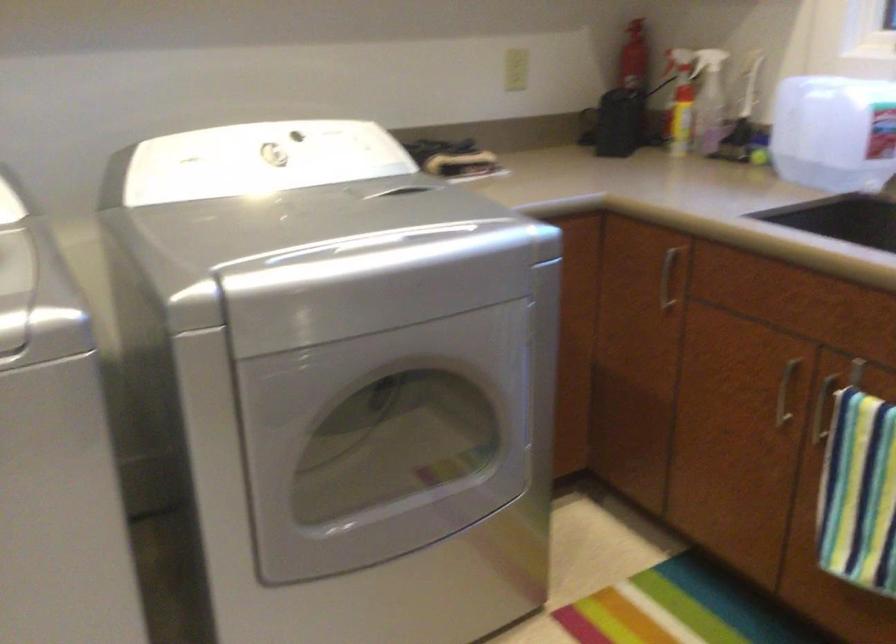
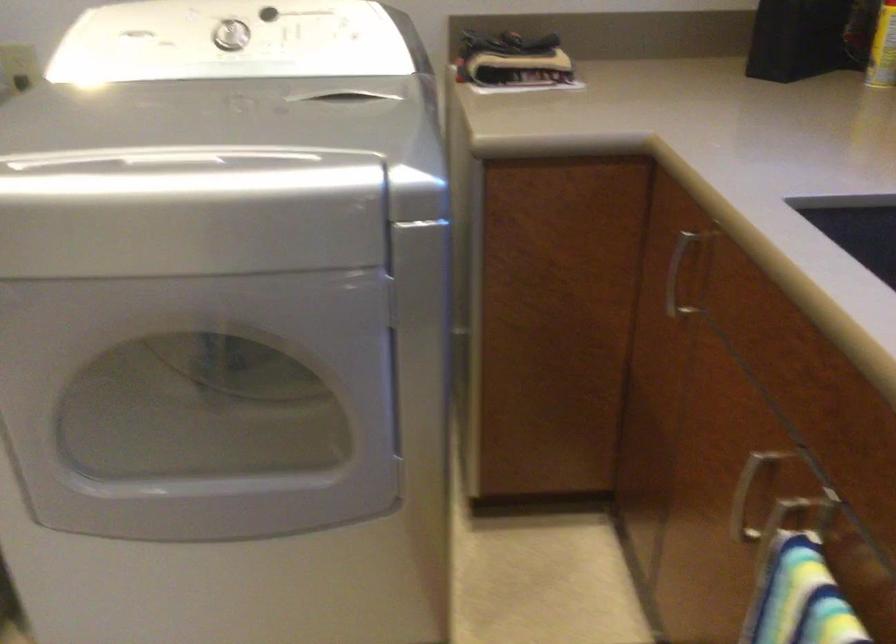
What movement of the cameraman would produce the second image?

The cameraman moved toward right, forward.